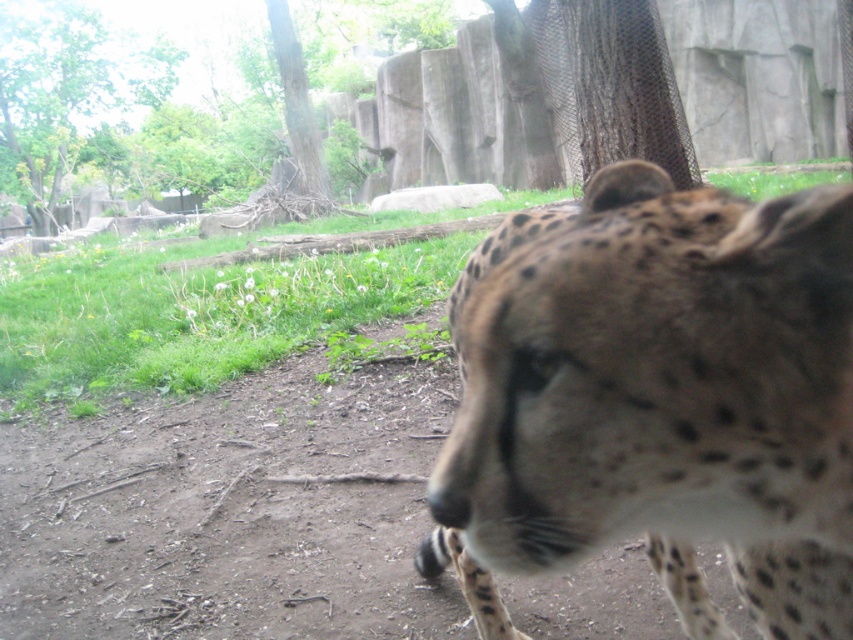
Question: Is spotted fur cheetah at center wider than green leafy tree at upper left?

Choices:
 (A) no
 (B) yes

Answer: (A)

Question: Which point is closer to the camera taking this photo?

Choices:
 (A) (608, 256)
 (B) (167, 58)

Answer: (A)

Question: Which of the following is the closest to the observer?

Choices:
 (A) (97, 33)
 (B) (531, 438)

Answer: (B)

Question: Can you confirm if spotted fur cheetah at center is smaller than green leafy tree at upper left?

Choices:
 (A) no
 (B) yes

Answer: (A)

Question: Does spotted fur cheetah at center have a lesser width compared to green leafy tree at upper left?

Choices:
 (A) no
 (B) yes

Answer: (B)